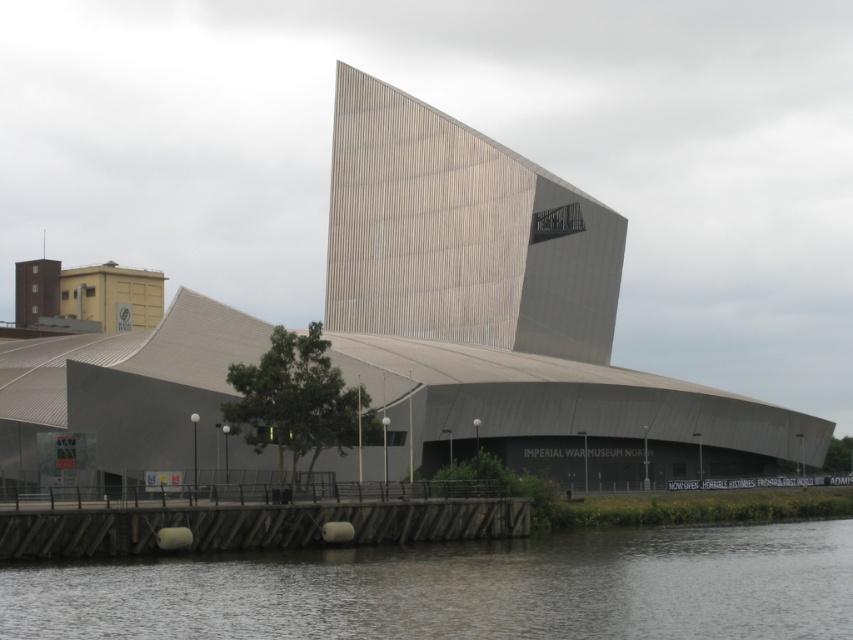
You are standing at the Imperial War Museum North and want to take a photo of the two points marked in the scene. Which point, point (212,609) or point (401,186), will appear larger in your camera view?

Point (212,609) will appear larger in the camera view because it is closer to the viewer than point (401,186).